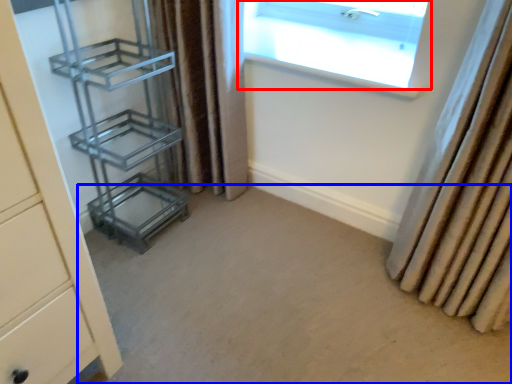
Question: Which point is closer to the camera, window (highlighted by a red box) or plain (highlighted by a blue box)?

Choices:
 (A) window
 (B) plain

Answer: (B)